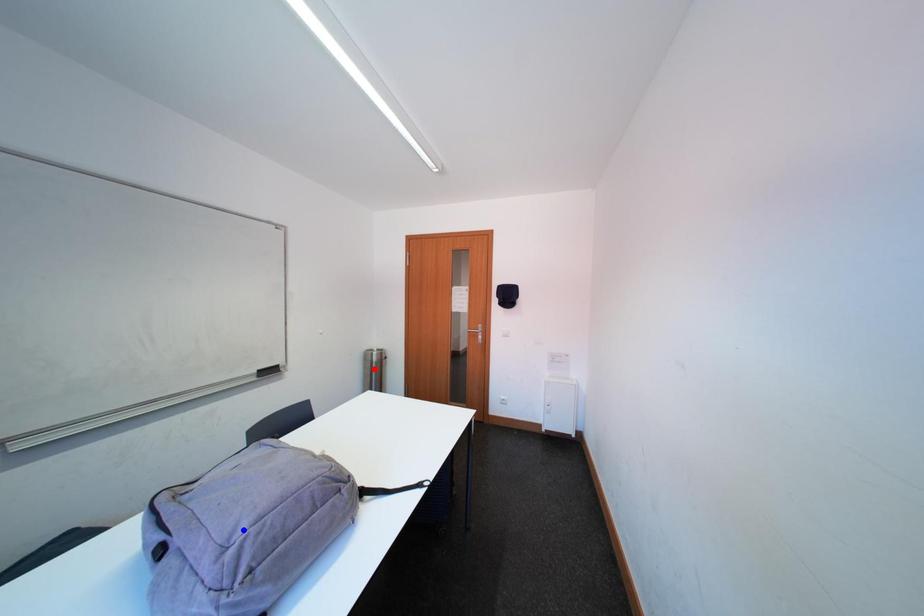
Question: In the image, two points are highlighted. Which point is nearer to the camera? Reply with the corresponding letter.

Choices:
 (A) blue point
 (B) red point

Answer: (A)